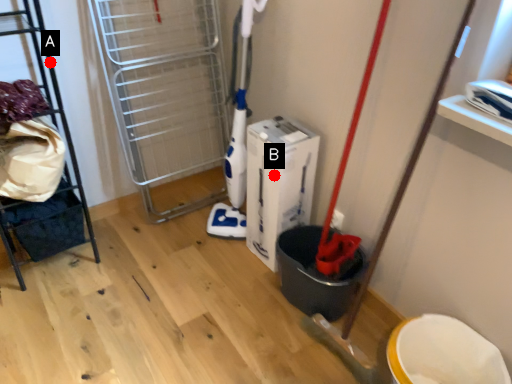
Question: Two points are circled on the image, labeled by A and B beside each circle. Which point is further to the camera?

Choices:
 (A) A is further
 (B) B is further

Answer: (A)